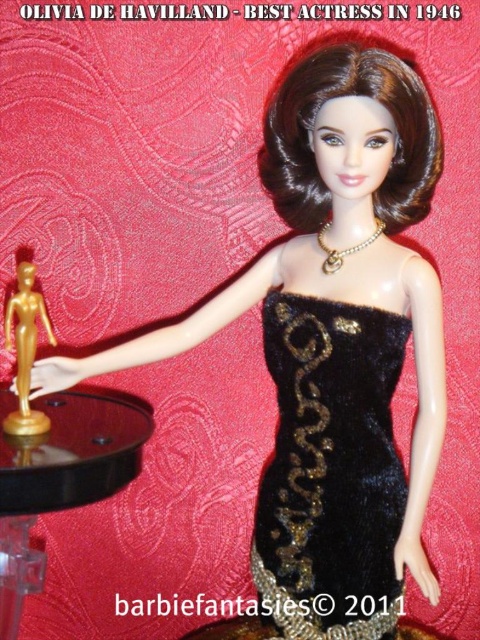
Between point (308, 355) and point (16, 368), which one is positioned behind?

Point (16, 368)

Is velvet black dress at center closer to camera compared to gold metallic statuette at center?

That is True.

This screenshot has width=480, height=640. Describe the element at coordinates (330, 472) in the screenshot. I see `velvet black dress at center` at that location.

At what (x,y) coordinates should I click in order to perform the action: click on velvet black dress at center. Please return your answer as a coordinate pair (x, y). Looking at the image, I should click on (330, 472).

Is black glossy table at lower left further to camera compared to gold metallic statuette at center?

No, it is in front of gold metallic statuette at center.

Is black glossy table at lower left smaller than gold metallic statuette at center?

No, black glossy table at lower left is not smaller than gold metallic statuette at center.

Where is `black glossy table at lower left`? Image resolution: width=480 pixels, height=640 pixels. black glossy table at lower left is located at coordinates (60, 476).

Is velvet black dress at center smaller than black glossy table at lower left?

Yes, velvet black dress at center is smaller than black glossy table at lower left.

At what (x,y) coordinates should I click in order to perform the action: click on velvet black dress at center. Please return your answer as a coordinate pair (x, y). Looking at the image, I should click on (330, 472).

The width and height of the screenshot is (480, 640). What do you see at coordinates (330, 472) in the screenshot?
I see `velvet black dress at center` at bounding box center [330, 472].

The height and width of the screenshot is (640, 480). What are the coordinates of `velvet black dress at center` in the screenshot? It's located at (330, 472).